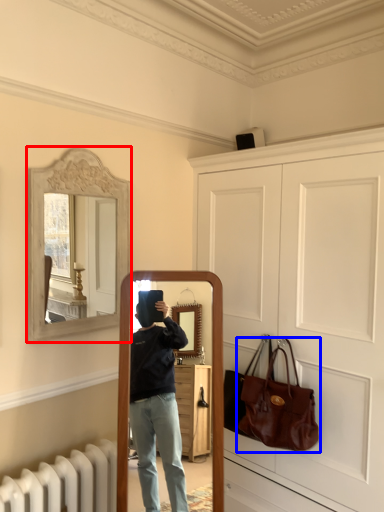
Question: Among these objects, which one is nearest to the camera, picture frame (highlighted by a red box) or handbag (highlighted by a blue box)?

Choices:
 (A) picture frame
 (B) handbag

Answer: (A)